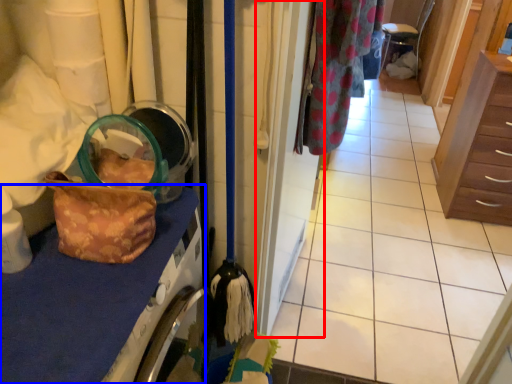
Question: Which point is closer to the camera, door (highlighted by a red box) or counter top (highlighted by a blue box)?

Choices:
 (A) door
 (B) counter top

Answer: (B)